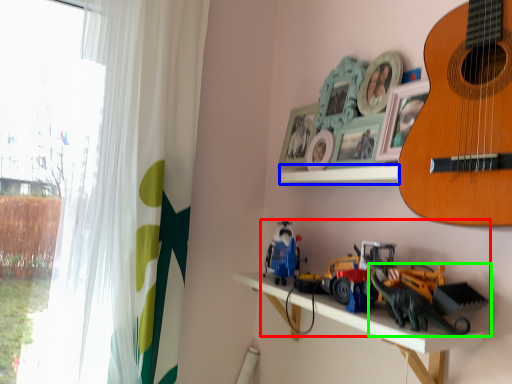
Question: Based on their relative distances, which object is nearer to toy (highlighted by a red box)? Choose from window sill (highlighted by a blue box) and toy (highlighted by a green box).

Choices:
 (A) window sill
 (B) toy

Answer: (B)